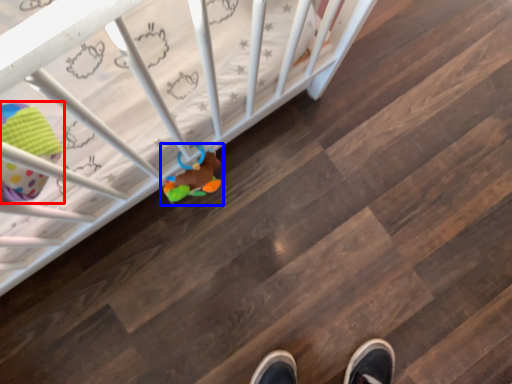
Question: Which object appears closest to the camera in this image, toy (highlighted by a red box) or toy (highlighted by a blue box)?

Choices:
 (A) toy
 (B) toy

Answer: (A)